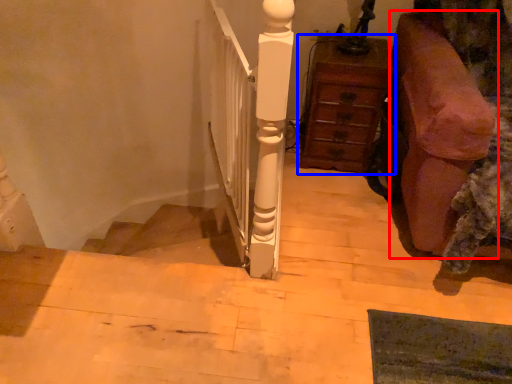
Question: Which object appears closest to the camera in this image, furniture (highlighted by a red box) or chest of drawers (highlighted by a blue box)?

Choices:
 (A) furniture
 (B) chest of drawers

Answer: (A)